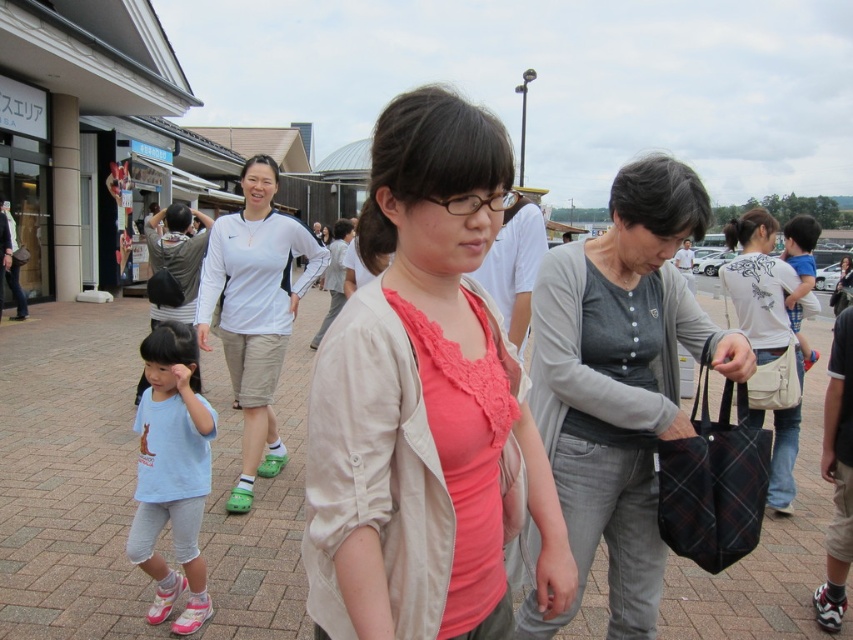
You are a delivery person who needs to place a gray cotton sweater at center onto a brick pavement at center. The delivery robot you are using has a maximum reach of 4 meters. Can you deliver the sweater to the designated spot without moving the robot closer?

The brick pavement at center and gray cotton sweater at center are 5.02 meters apart. Since the robot can only reach 4 meters, you cannot deliver the sweater without moving the robot closer.

In the scene shown: You are a photographer standing at the edge of the scene. You want to capture a photo that includes both the brick pavement at center and the light blue cotton shirt at left. Which object should be placed closer to the bottom of the frame to ensure both are fully visible?

The brick pavement at center is taller than the light blue cotton shirt at left, so to ensure both are fully visible in the photo, the light blue cotton shirt at left should be placed closer to the bottom of the frame since it is shorter.